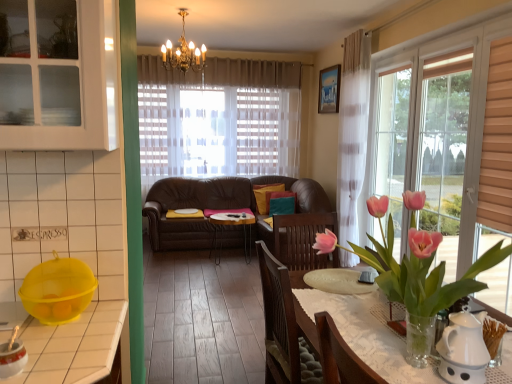
Question: Is the depth of white glass cabinet at upper left less than that of transparent glass window at right?

Choices:
 (A) yes
 (B) no

Answer: (A)

Question: Is white glass cabinet at upper left next to transparent glass window at right?

Choices:
 (A) yes
 (B) no

Answer: (B)

Question: From the image's perspective, is white glass cabinet at upper left located beneath transparent glass window at right?

Choices:
 (A) yes
 (B) no

Answer: (B)

Question: Is transparent glass window at right surrounded by white glass cabinet at upper left?

Choices:
 (A) no
 (B) yes

Answer: (A)

Question: Could you tell me if white glass cabinet at upper left is facing transparent glass window at right?

Choices:
 (A) no
 (B) yes

Answer: (A)

Question: Does white glass cabinet at upper left have a greater height compared to transparent glass window at right?

Choices:
 (A) yes
 (B) no

Answer: (B)

Question: Is transparent glass window at right positioned far away from white glass cabinet at upper left?

Choices:
 (A) yes
 (B) no

Answer: (A)

Question: From the image's perspective, does transparent glass window at right appear lower than white glass cabinet at upper left?

Choices:
 (A) no
 (B) yes

Answer: (B)

Question: Is transparent glass window at right at the right side of white glass cabinet at upper left?

Choices:
 (A) no
 (B) yes

Answer: (B)

Question: Can you confirm if transparent glass window at right is smaller than white glass cabinet at upper left?

Choices:
 (A) yes
 (B) no

Answer: (B)

Question: Can you confirm if transparent glass window at right is wider than white glass cabinet at upper left?

Choices:
 (A) no
 (B) yes

Answer: (B)

Question: Are transparent glass window at right and white glass cabinet at upper left beside each other?

Choices:
 (A) yes
 (B) no

Answer: (B)

Question: In the image, is white glass cabinet at upper left positioned in front of or behind transparent glass window at right?

Choices:
 (A) behind
 (B) front

Answer: (B)